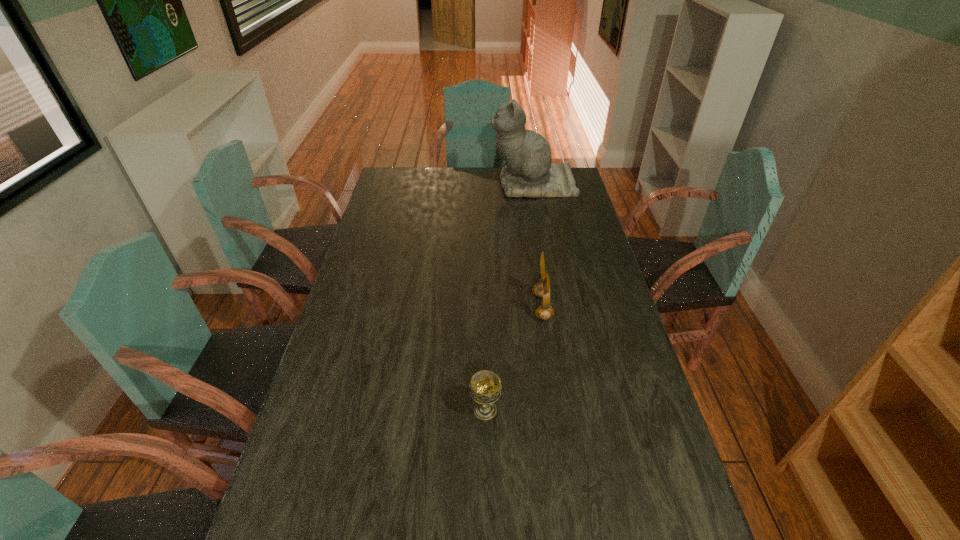
In order to click on free spot between the second nearest object and the cat in this screenshot , I will do `click(538, 246)`.

Identify the location of vacant area that lies between the nearest object and the second nearest object. (514, 359).

Find the location of a particular element. Image resolution: width=960 pixels, height=540 pixels. free spot between the farthest object and the chalice is located at coordinates (509, 297).

Find the location of a particular element. free area in between the farthest object and the earphone is located at coordinates (538, 246).

You are a GUI agent. You are given a task and a screenshot of the screen. Output one action in this format:
    pyautogui.click(x=<x>, y=<y>)
    Task: Click on the free space between the second shortest object and the nearest object
    
    Given the screenshot: What is the action you would take?
    pyautogui.click(x=514, y=359)

This screenshot has width=960, height=540. Find the location of `object that is the closest to the farthest object`. object that is the closest to the farthest object is located at coordinates (542, 289).

Where is `object that is the second nearest to the earphone`? The height and width of the screenshot is (540, 960). object that is the second nearest to the earphone is located at coordinates (528, 172).

At what (x,y) coordinates should I click in order to perform the action: click on vacant area in the image that satisfies the following two spatial constraints: 1. on the front-facing side of the tallest object; 2. on the front side of the chalice. Please return your answer as a coordinate pair (x, y). The image size is (960, 540). Looking at the image, I should click on (574, 410).

The image size is (960, 540). What are the coordinates of `free region that satisfies the following two spatial constraints: 1. on the front-facing side of the tallest object; 2. on the front side of the chalice` in the screenshot? It's located at (574, 410).